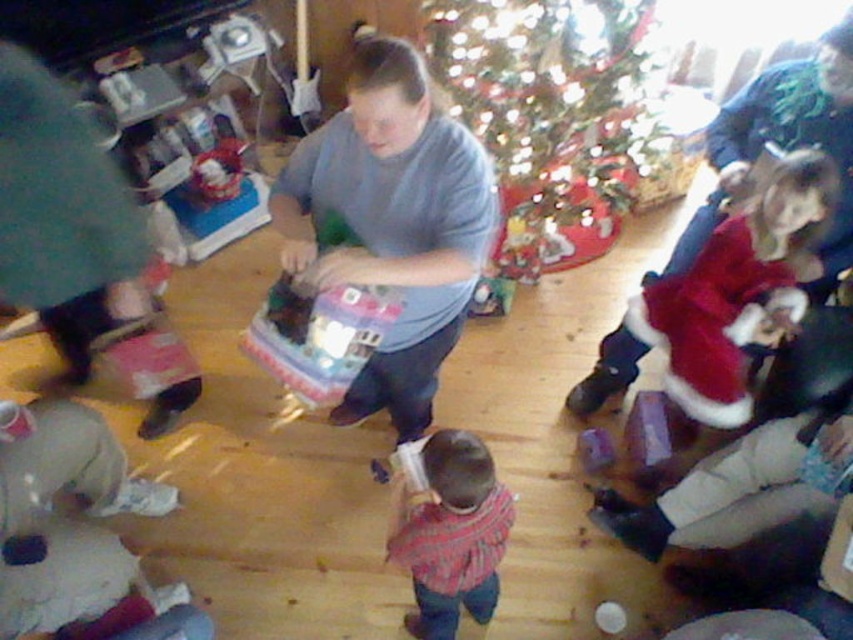
Consider the image. Can you confirm if matte gray shirt at center is taller than velvet red santa hat at lower left?

No, matte gray shirt at center is not taller than velvet red santa hat at lower left.

Which of these two, matte gray shirt at center or velvet red santa hat at lower left, stands taller?

With more height is velvet red santa hat at lower left.

Describe the element at coordinates (392, 221) in the screenshot. This screenshot has height=640, width=853. I see `matte gray shirt at center` at that location.

Locate an element on the screen. The image size is (853, 640). matte gray shirt at center is located at coordinates [x=392, y=221].

Between green glittering christmas tree at upper center and plaid shirt at center, which one is positioned lower?

plaid shirt at center

Is green glittering christmas tree at upper center closer to the viewer compared to plaid shirt at center?

No, it is not.

The image size is (853, 640). What do you see at coordinates (550, 115) in the screenshot?
I see `green glittering christmas tree at upper center` at bounding box center [550, 115].

The image size is (853, 640). What are the coordinates of `green glittering christmas tree at upper center` in the screenshot? It's located at (550, 115).

Does point (318, 244) come farther from viewer compared to point (653, 333)?

No, it is not.

Does matte gray shirt at center have a greater height compared to fuzzy red dress at lower right?

Yes.

Which is behind, point (471, 195) or point (788, 260)?

Point (788, 260)

Locate an element on the screen. The width and height of the screenshot is (853, 640). matte gray shirt at center is located at coordinates (392, 221).